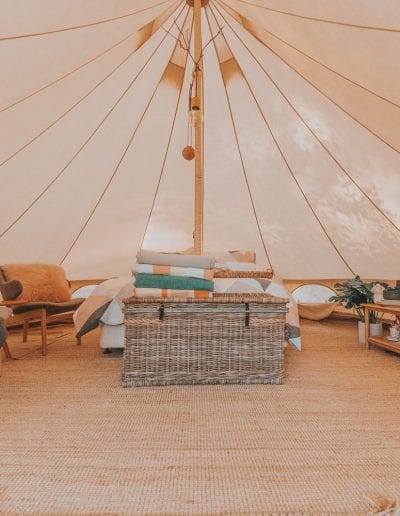
Locate an element on the screen. hinges is located at coordinates (247, 313), (160, 312).